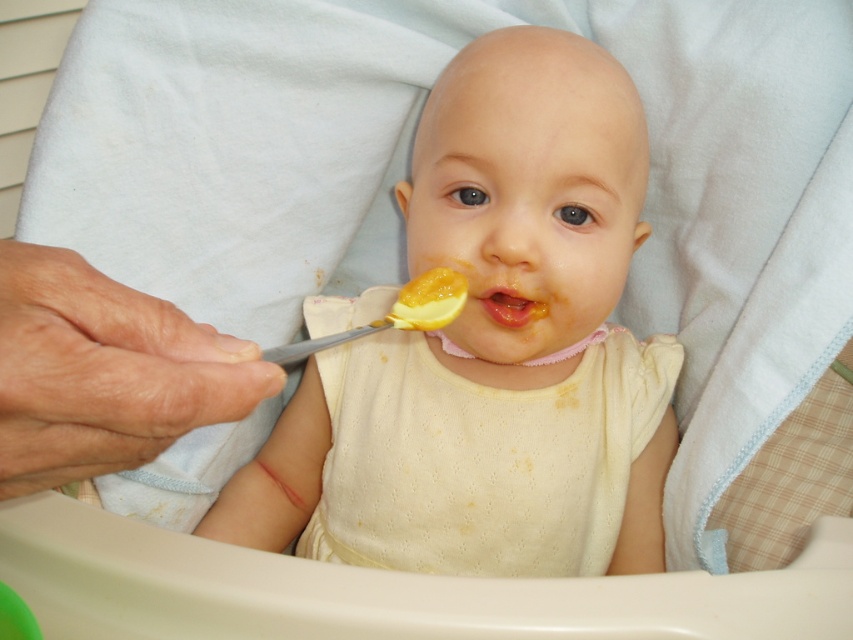
Between white dotted fabric bib at center and yellow matte food at center, which one is positioned higher?

Positioned higher is yellow matte food at center.

Does white dotted fabric bib at center have a greater width compared to yellow matte food at center?

Indeed, white dotted fabric bib at center has a greater width compared to yellow matte food at center.

Who is more distant from viewer, (x=578, y=570) or (x=492, y=300)?

The point (x=578, y=570) is behind.

Locate an element on the screen. white dotted fabric bib at center is located at coordinates (483, 458).

Looking at this image, does yellow matte spoon at center lie in front of white dotted fabric bib at center?

Yes, it is in front of white dotted fabric bib at center.

Measure the distance from yellow matte spoon at center to white dotted fabric bib at center.

yellow matte spoon at center is 1.68 inches from white dotted fabric bib at center.

Does point (569, 476) come farther from viewer compared to point (611, 540)?

No, (569, 476) is in front of (611, 540).

Identify the location of yellow matte spoon at center. (491, 349).

Locate an element on the screen. yellow matte spoon at center is located at coordinates (491, 349).

Can you confirm if yellow matte spoon at center is positioned to the right of yellow matte food at center?

No, yellow matte spoon at center is not to the right of yellow matte food at center.

Find the location of a particular element. This screenshot has width=853, height=640. yellow matte spoon at center is located at coordinates (491, 349).

Find the location of `yellow matte spoon at center`. yellow matte spoon at center is located at coordinates (491, 349).